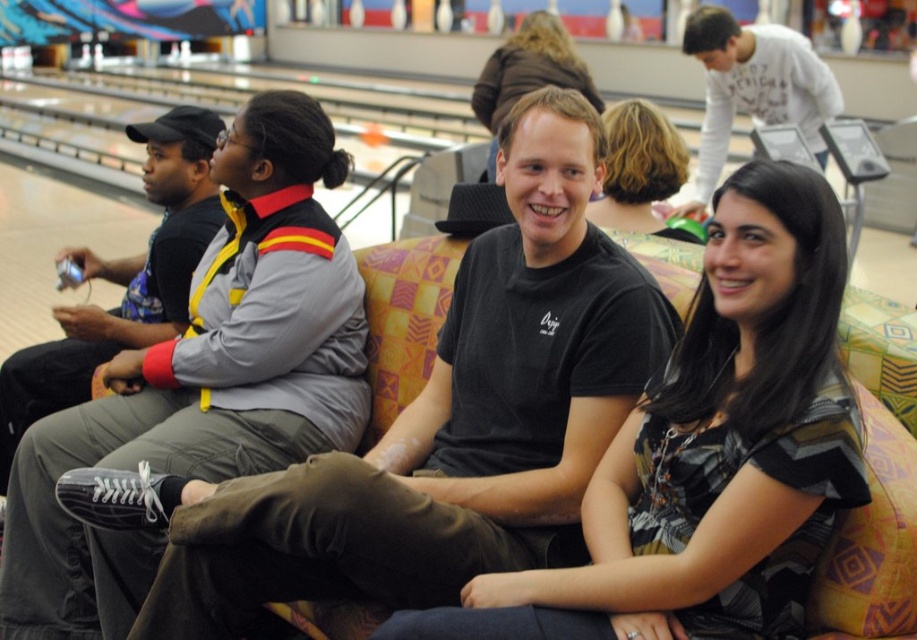
Between printed fabric dress at center and matte black shirt at center, which one is positioned higher?

matte black shirt at center is above.

Can you confirm if printed fabric dress at center is shorter than matte black shirt at center?

Incorrect, printed fabric dress at center's height does not fall short of matte black shirt at center's.

This screenshot has width=917, height=640. In order to click on printed fabric dress at center in this screenshot , I will do `click(710, 451)`.

This screenshot has height=640, width=917. In order to click on printed fabric dress at center in this screenshot , I will do `click(710, 451)`.

Does printed fabric dress at center appear under black matte sneakers at left?

Correct, printed fabric dress at center is located below black matte sneakers at left.

Describe the element at coordinates (710, 451) in the screenshot. This screenshot has height=640, width=917. I see `printed fabric dress at center` at that location.

Locate an element on the screen. Image resolution: width=917 pixels, height=640 pixels. printed fabric dress at center is located at coordinates (710, 451).

Can you confirm if printed fabric dress at center is positioned to the left of dark brown hair at center?

Yes, printed fabric dress at center is to the left of dark brown hair at center.

Between printed fabric dress at center and dark brown hair at center, which one is positioned higher?

dark brown hair at center is above.

Is point (794, 278) farther from camera compared to point (627, 173)?

No, it is not.

Image resolution: width=917 pixels, height=640 pixels. In order to click on printed fabric dress at center in this screenshot , I will do `click(710, 451)`.